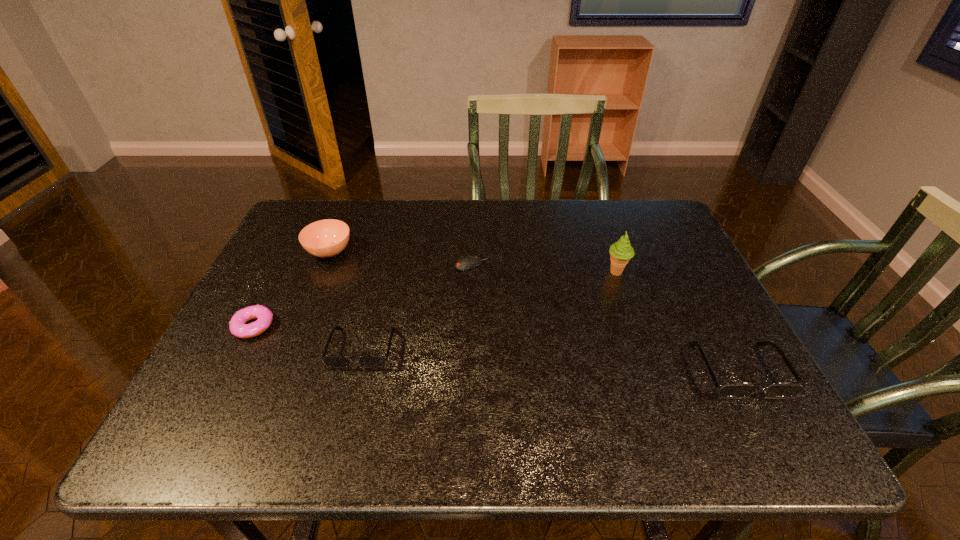
This screenshot has height=540, width=960. I want to click on object that is at the near right corner, so click(x=730, y=389).

Where is `free location at the far edge of the desktop`? free location at the far edge of the desktop is located at coordinates (506, 225).

Where is `free space at the right edge of the desktop`? This screenshot has height=540, width=960. free space at the right edge of the desktop is located at coordinates (669, 260).

Locate an element on the screen. This screenshot has width=960, height=540. vacant space at the near left corner of the desktop is located at coordinates (256, 378).

I want to click on free space at the far right corner of the desktop, so click(636, 225).

Identify the location of vacant area that lies between the tallest object and the taller sunglasses. (677, 321).

The height and width of the screenshot is (540, 960). Find the location of `vacant space that's between the doughnut and the second object from right to left`. vacant space that's between the doughnut and the second object from right to left is located at coordinates (435, 299).

This screenshot has height=540, width=960. Identify the location of vacant area that lies between the third shortest object and the doughnut. (308, 338).

Find the location of a particular element. empty space between the tallest object and the computer mouse is located at coordinates (543, 268).

I want to click on blank region between the doughnut and the third tallest object, so click(496, 348).